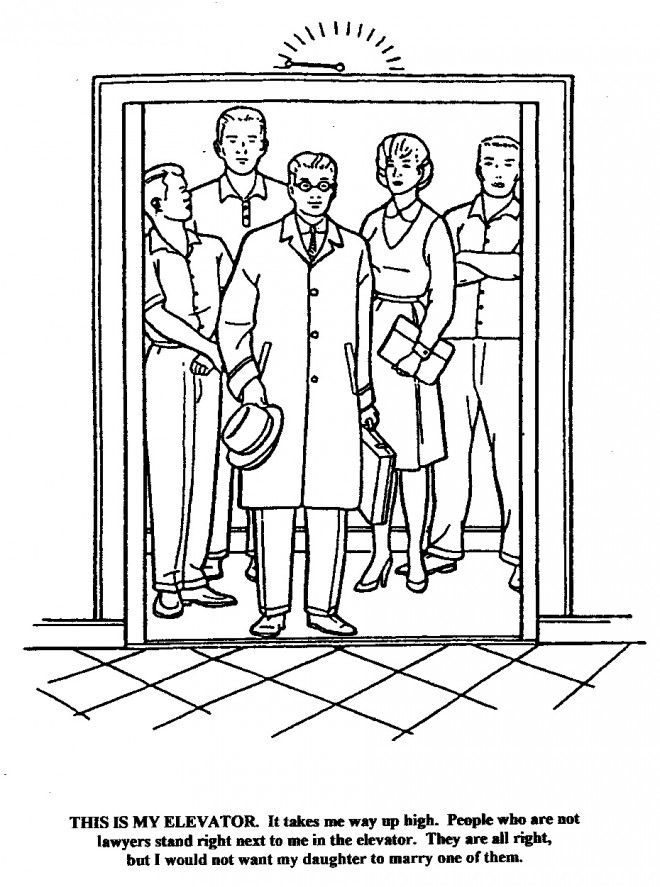
Locate an element on the screen. This screenshot has width=660, height=887. elevator is located at coordinates (317, 131).